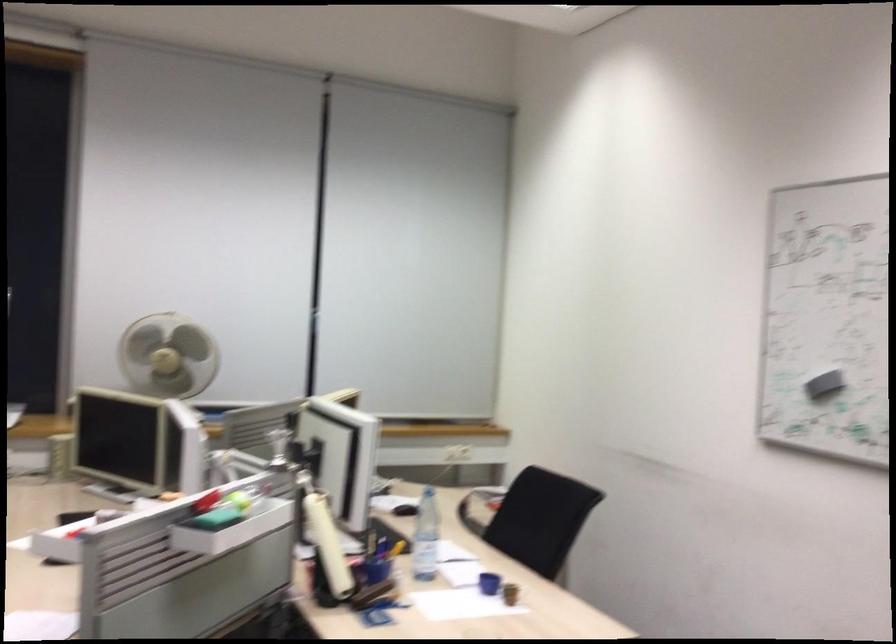
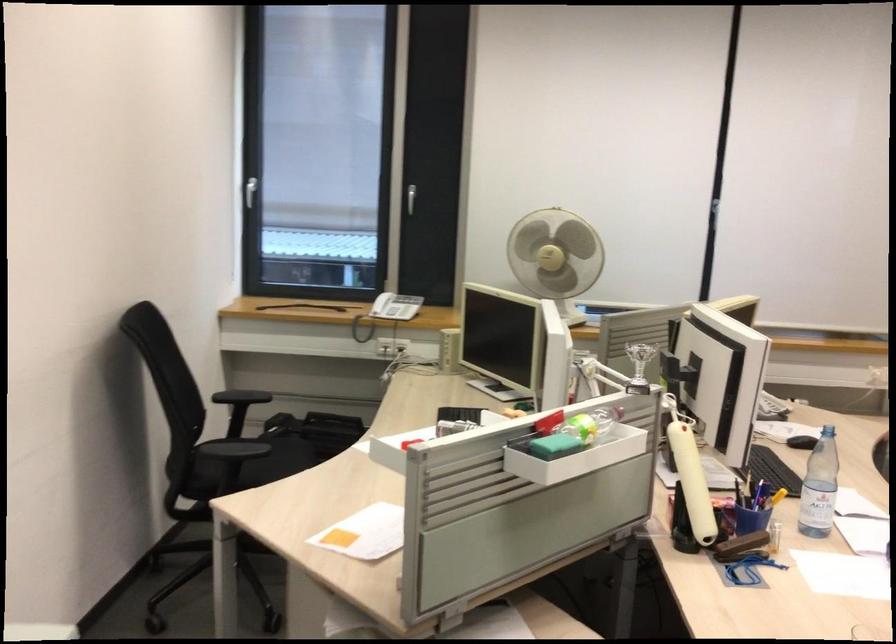
Locate, in the second image, the point that corresponds to point (418, 538) in the first image.

(819, 487)